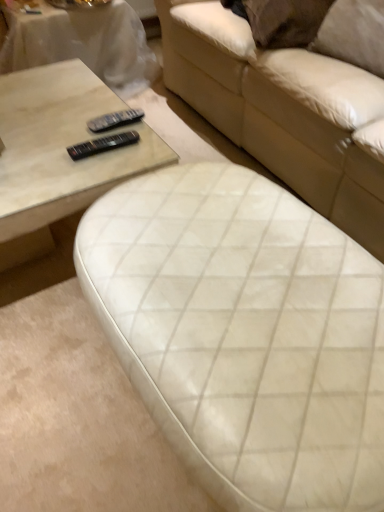
At what (x,y) coordinates should I click in order to perform the action: click on free location in front of black plastic remote at center, which is counted as the 1th remote, starting from the bottom. Please return your answer as a coordinate pair (x, y). Image resolution: width=384 pixels, height=512 pixels. Looking at the image, I should click on (85, 176).